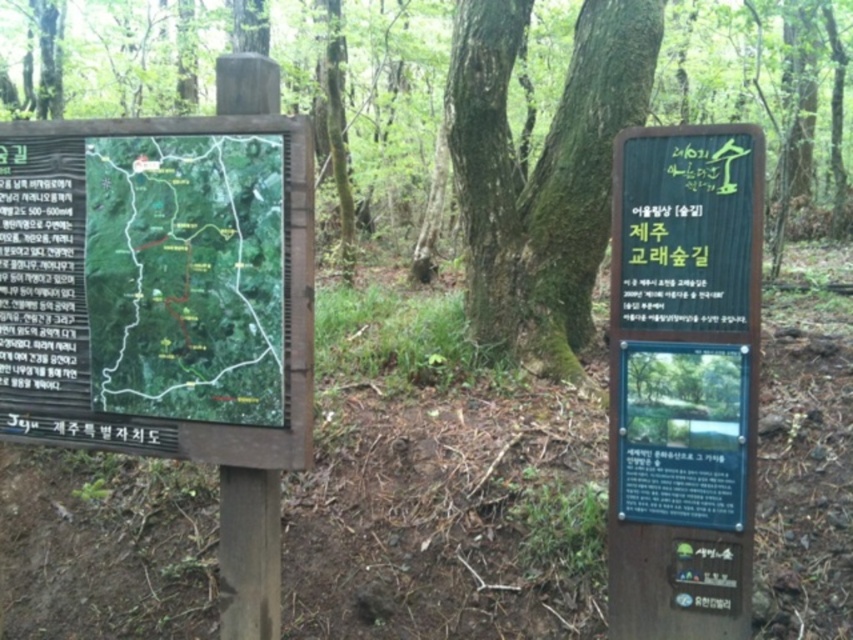
Question: Which of the following is the closest to the observer?

Choices:
 (A) (685, 570)
 (B) (540, 241)
 (C) (102, 204)

Answer: (A)

Question: Is the position of green wooden sign at center less distant than that of green matte map at center-left?

Choices:
 (A) no
 (B) yes

Answer: (B)

Question: Which of these objects is positioned closest to the green matte map at center-left?

Choices:
 (A) green wooden sign at center
 (B) green mossy tree at center

Answer: (A)

Question: Can you confirm if green matte map at center-left is positioned to the right of green mossy tree at center?

Choices:
 (A) yes
 (B) no

Answer: (B)

Question: Where is green wooden sign at center located in relation to green mossy tree at center in the image?

Choices:
 (A) right
 (B) left

Answer: (A)

Question: Estimate the real-world distances between objects in this image. Which object is closer to the green mossy tree at center?

Choices:
 (A) green matte map at center-left
 (B) green wooden sign at center

Answer: (B)